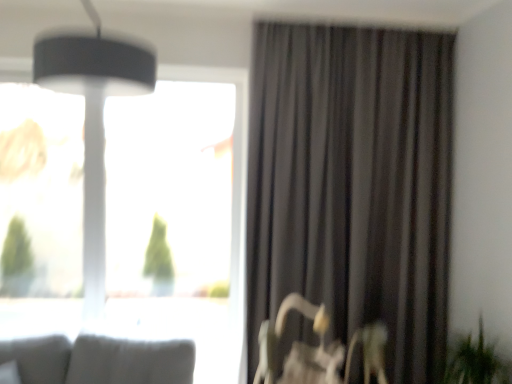
Question: From a real-world perspective, is metallic silver swivel chair at lower right beneath dark grey fabric curtain at right?

Choices:
 (A) yes
 (B) no

Answer: (A)

Question: From the image's perspective, would you say metallic silver swivel chair at lower right is positioned over dark grey fabric curtain at right?

Choices:
 (A) yes
 (B) no

Answer: (B)

Question: Would you say metallic silver swivel chair at lower right is a long distance from dark grey fabric curtain at right?

Choices:
 (A) no
 (B) yes

Answer: (A)

Question: Does metallic silver swivel chair at lower right have a lesser height compared to dark grey fabric curtain at right?

Choices:
 (A) no
 (B) yes

Answer: (B)

Question: Does metallic silver swivel chair at lower right come behind dark grey fabric curtain at right?

Choices:
 (A) yes
 (B) no

Answer: (B)

Question: Is metallic silver swivel chair at lower right located outside dark grey fabric curtain at right?

Choices:
 (A) no
 (B) yes

Answer: (B)

Question: Is matte black lampshade at upper left positioned with its back to metallic silver swivel chair at lower right?

Choices:
 (A) no
 (B) yes

Answer: (A)

Question: Can you confirm if matte black lampshade at upper left is thinner than metallic silver swivel chair at lower right?

Choices:
 (A) no
 (B) yes

Answer: (B)

Question: From the image's perspective, is matte black lampshade at upper left located beneath metallic silver swivel chair at lower right?

Choices:
 (A) no
 (B) yes

Answer: (A)

Question: Can you confirm if matte black lampshade at upper left is positioned to the right of metallic silver swivel chair at lower right?

Choices:
 (A) no
 (B) yes

Answer: (A)

Question: Is matte black lampshade at upper left located outside metallic silver swivel chair at lower right?

Choices:
 (A) no
 (B) yes

Answer: (B)

Question: From the image's perspective, is matte black lampshade at upper left on top of metallic silver swivel chair at lower right?

Choices:
 (A) yes
 (B) no

Answer: (A)

Question: From a real-world perspective, is transparent glass window at upper left on top of green leafy plant at lower right?

Choices:
 (A) yes
 (B) no

Answer: (A)